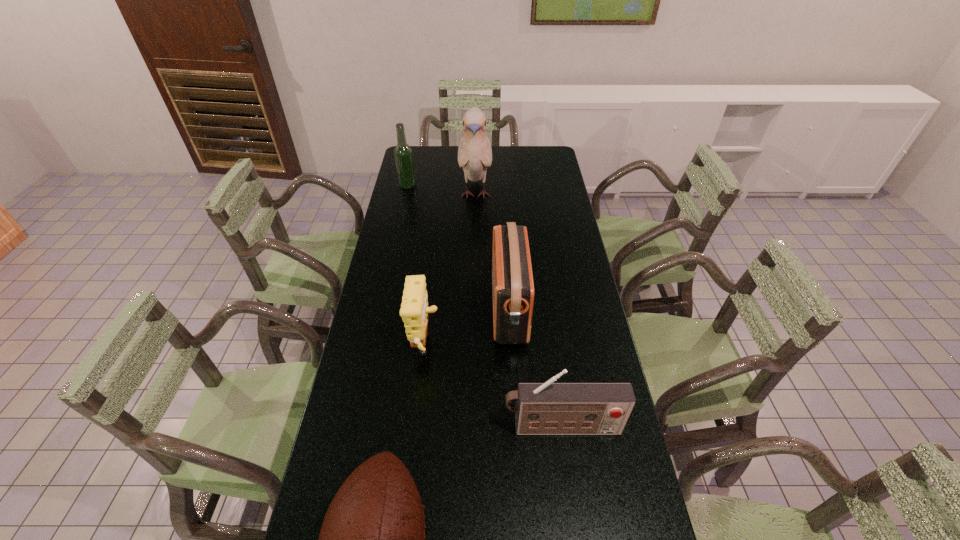
At what (x,y) coordinates should I click in order to perform the action: click on vacant space that's between the sponge and the liquor. Please return your answer as a coordinate pair (x, y). This screenshot has width=960, height=540. Looking at the image, I should click on tap(417, 268).

Where is `unoccupied position between the tallest object and the farther radio receiver`? unoccupied position between the tallest object and the farther radio receiver is located at coordinates (492, 252).

You are a GUI agent. You are given a task and a screenshot of the screen. Output one action in this format:
    pyautogui.click(x=<x>, y=<y>)
    Task: Click on the vacant area between the sponge and the farther radio receiver
    
    Given the screenshot: What is the action you would take?
    pyautogui.click(x=468, y=330)

The image size is (960, 540). Identify the location of unoccupied area between the sponge and the nearer radio receiver. (493, 389).

Locate an element on the screen. The height and width of the screenshot is (540, 960). free space that is in between the liquor and the farther radio receiver is located at coordinates click(458, 247).

Identify the location of unoccupied position between the farther radio receiver and the sponge. This screenshot has width=960, height=540. (468, 330).

Find the location of `the fourth closest object to the farther radio receiver`. the fourth closest object to the farther radio receiver is located at coordinates (372, 539).

You are a GUI agent. You are given a task and a screenshot of the screen. Output one action in this format:
    pyautogui.click(x=<x>, y=<y>)
    Task: Click on the object that ranks as the fourth closest to the liquor
    The image size is (960, 540).
    Given the screenshot: What is the action you would take?
    pyautogui.click(x=548, y=408)